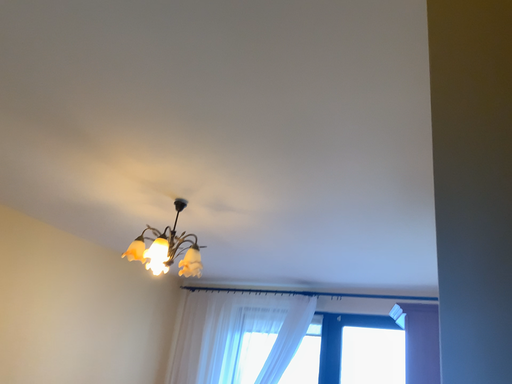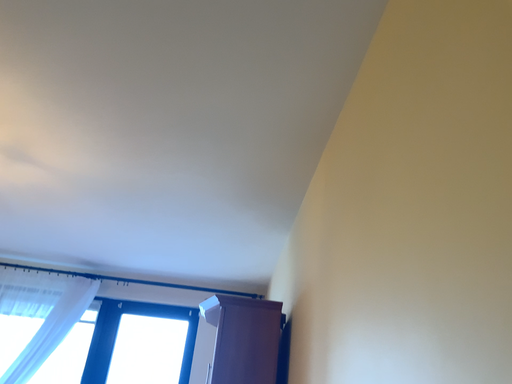
Question: Which way did the camera rotate in the video?

Choices:
 (A) rotated left
 (B) rotated right

Answer: (B)